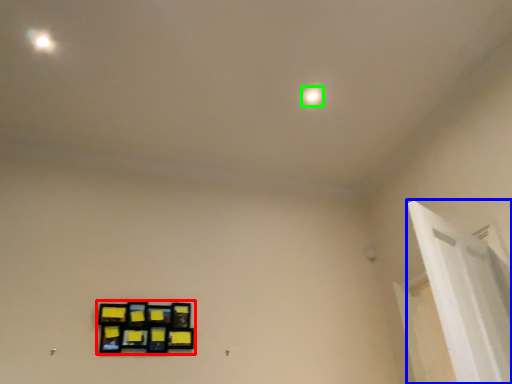
Question: Which object is positioned closest to picture frame (highlighted by a red box)? Select from window frame (highlighted by a blue box) and dot (highlighted by a green box).

Choices:
 (A) window frame
 (B) dot

Answer: (A)